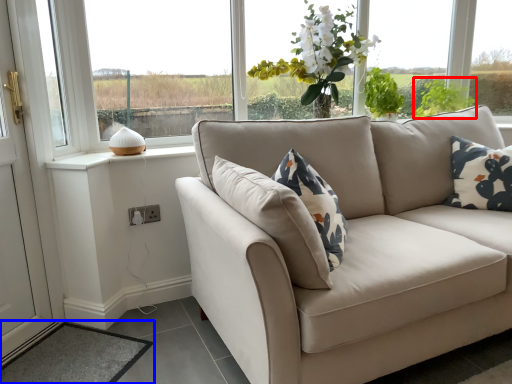
Question: Among these objects, which one is nearest to the camera, plant (highlighted by a red box) or mat (highlighted by a blue box)?

Choices:
 (A) plant
 (B) mat

Answer: (B)